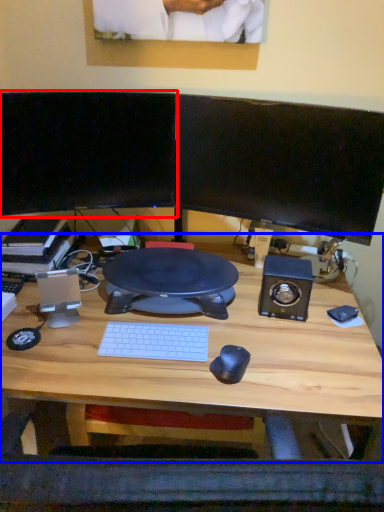
Question: Which of the following is the closest to the observer, computer monitor (highlighted by a red box) or desk (highlighted by a blue box)?

Choices:
 (A) computer monitor
 (B) desk

Answer: (B)